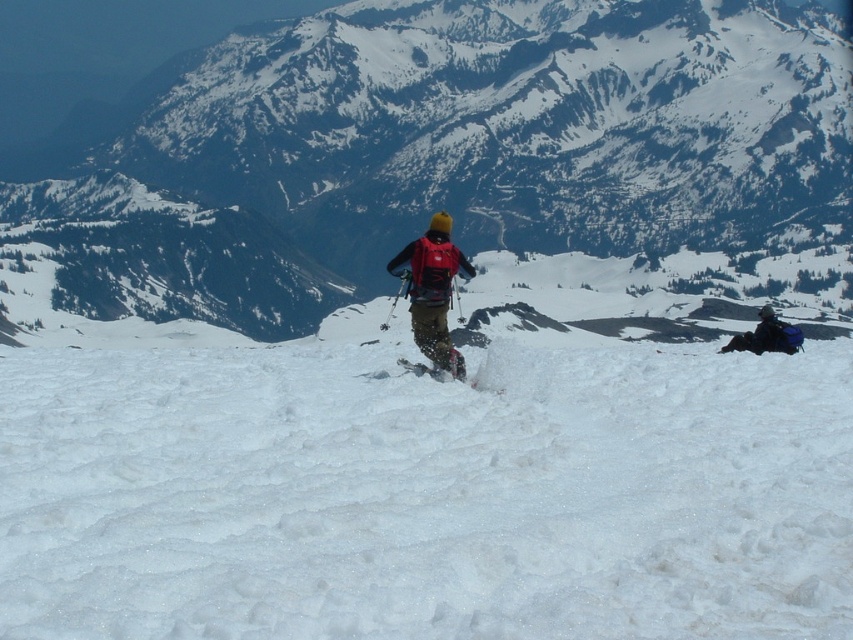
Can you confirm if white snow at center is thinner than white snow mountain at center?

Correct, white snow at center's width is less than white snow mountain at center's.

Can you confirm if white snow at center is bigger than white snow mountain at center?

Incorrect, white snow at center is not larger than white snow mountain at center.

Which is behind, point (848, 536) or point (466, 152)?

Positioned behind is point (466, 152).

Locate an element on the screen. This screenshot has height=640, width=853. white snow at center is located at coordinates (425, 493).

Can you confirm if white snow at center is taller than blue fabric backpack at right?

Correct, white snow at center is much taller as blue fabric backpack at right.

How distant is white snow at center from blue fabric backpack at right?

white snow at center is 37.67 meters from blue fabric backpack at right.

Find the location of `white snow at center`. white snow at center is located at coordinates (425, 493).

This screenshot has width=853, height=640. Find the location of `white snow at center`. white snow at center is located at coordinates (425, 493).

Between white snow at center and matte black ski at center, which one appears on the left side from the viewer's perspective?

Positioned to the left is white snow at center.

The width and height of the screenshot is (853, 640). Find the location of `white snow at center`. white snow at center is located at coordinates (425, 493).

You are a GUI agent. You are given a task and a screenshot of the screen. Output one action in this format:
    pyautogui.click(x=<x>, y=<y>)
    Task: Click on the white snow at center
    The image size is (853, 640).
    Given the screenshot: What is the action you would take?
    pyautogui.click(x=425, y=493)